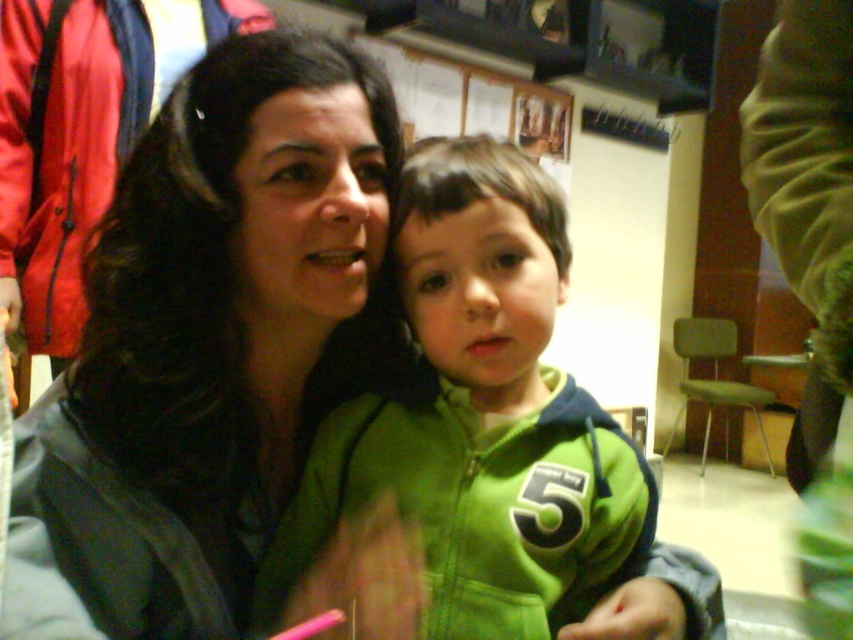
Is point (367, 262) behind point (111, 147)?

No, it is in front of (111, 147).

Find the location of a particular element. This screenshot has width=853, height=640. matte black jacket at upper left is located at coordinates (209, 344).

Locate an element on the screen. matte black jacket at upper left is located at coordinates (209, 344).

Between green fleece jacket at center and matte black jacket at left, which one is positioned higher?

matte black jacket at left

Can you confirm if green fleece jacket at center is positioned above matte black jacket at left?

No.

Who is more distant from viewer, (527,346) or (129,13)?

The point (129,13) is more distant.

Find the location of a particular element. green fleece jacket at center is located at coordinates (480, 419).

Is matte black jacket at upper left below green fleece jacket at center?

Actually, matte black jacket at upper left is above green fleece jacket at center.

Does matte black jacket at upper left have a lesser width compared to green fleece jacket at center?

Correct, matte black jacket at upper left's width is less than green fleece jacket at center's.

Between point (277, 368) and point (563, 481), which one is positioned behind?

The point (277, 368) is more distant.

This screenshot has height=640, width=853. Identify the location of matte black jacket at upper left. (209, 344).